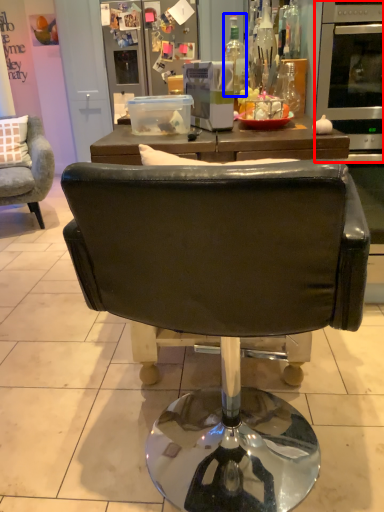
Question: Which object is further to the camera taking this photo, oven (highlighted by a red box) or bottle (highlighted by a blue box)?

Choices:
 (A) oven
 (B) bottle

Answer: (B)